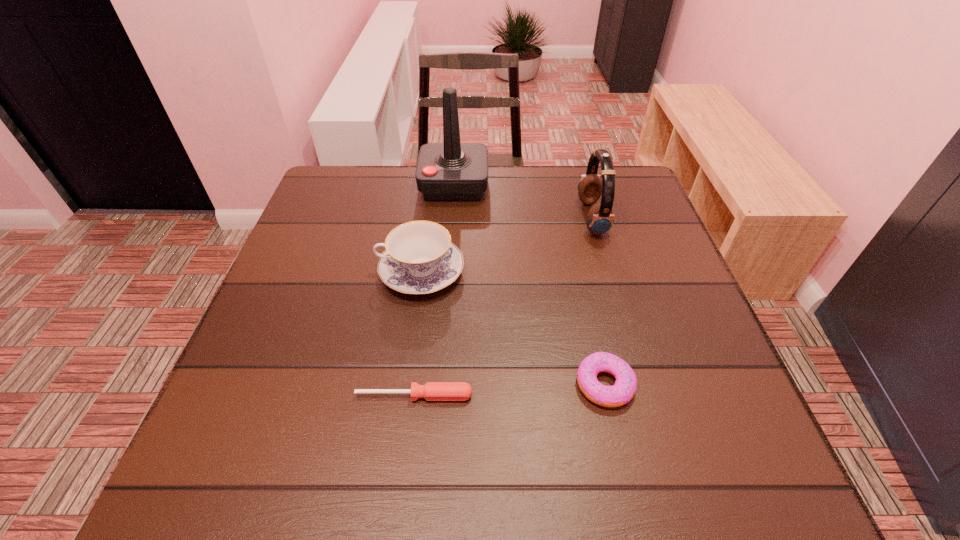
The width and height of the screenshot is (960, 540). Identify the location of vacant region at the near edge of the desktop. (597, 480).

This screenshot has height=540, width=960. In the image, there is a desktop. Identify the location of free space at the left edge. (361, 231).

At what (x,y) coordinates should I click in order to perform the action: click on vacant area at the right edge. Please return your answer as a coordinate pair (x, y). The height and width of the screenshot is (540, 960). Looking at the image, I should click on (611, 251).

The width and height of the screenshot is (960, 540). Identify the location of free location at the far left corner of the desktop. (345, 213).

At what (x,y) coordinates should I click in order to perform the action: click on free space at the near left corner. Please return your answer as a coordinate pair (x, y). Looking at the image, I should click on (249, 479).

Locate an element on the screen. The width and height of the screenshot is (960, 540). free space at the near right corner of the desktop is located at coordinates (689, 483).

The width and height of the screenshot is (960, 540). What are the coordinates of `free area in between the joystick and the fourth shortest object` in the screenshot? It's located at (523, 201).

Identify the location of free space that is in between the second shortest object and the chinaware. 513,328.

Find the location of a particular element. The height and width of the screenshot is (540, 960). vacant area that lies between the headset and the second shortest object is located at coordinates pos(598,301).

At what (x,y) coordinates should I click in order to perform the action: click on free space between the shortest object and the fourth shortest object. Please return your answer as a coordinate pair (x, y). The image size is (960, 540). Looking at the image, I should click on (503, 307).